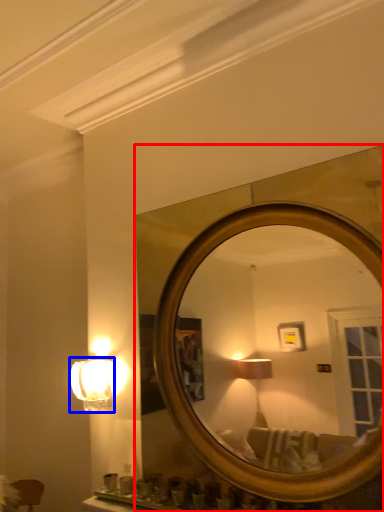
Question: Which of the following is the closest to the observer, mirror (highlighted by a red box) or lamp (highlighted by a blue box)?

Choices:
 (A) mirror
 (B) lamp

Answer: (A)